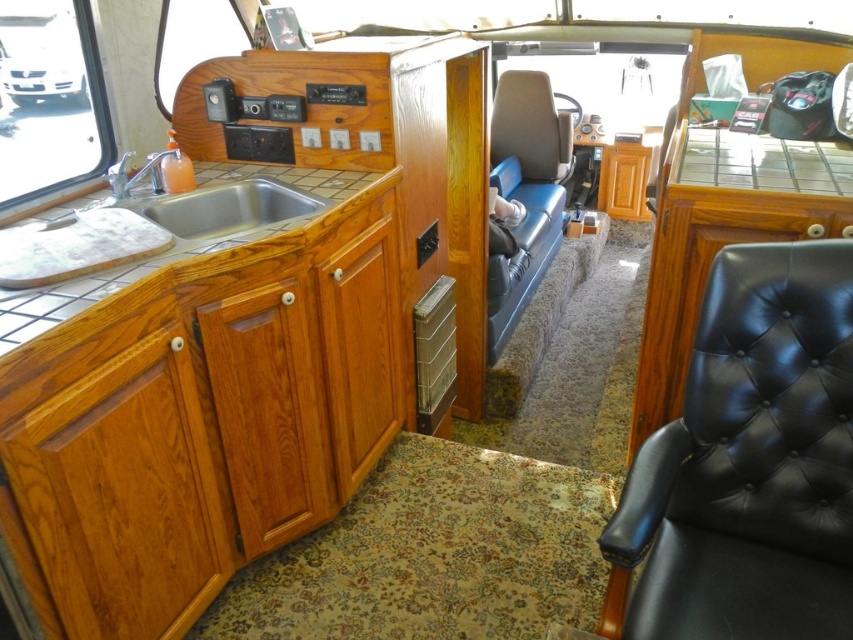
You are inside a camper van and need to reach two points marked in the image. The first point is at coordinate point (502, 189) and the second is at point (367, 211). Which point is closer to you?

Point (502, 189) is further to the camera than point (367, 211), so the second point is closer to you.

You are a traveler who needs to sit comfortably in the camper van. You see a blue leather armchair at center and a wooden drawer at center. Which one is taller so you can sit on it comfortably?

The blue leather armchair at center is taller than the wooden drawer at center, so you can sit on it comfortably.

Looking at this image, you are standing inside the camper van and want to reach a point that is exactly 1.72 meters away from you. Can you identify the point at coordinates point (151, 198) as the correct location?

Yes, the point (151, 198) is exactly 1.72 meters away from the viewer, so it is the correct location.